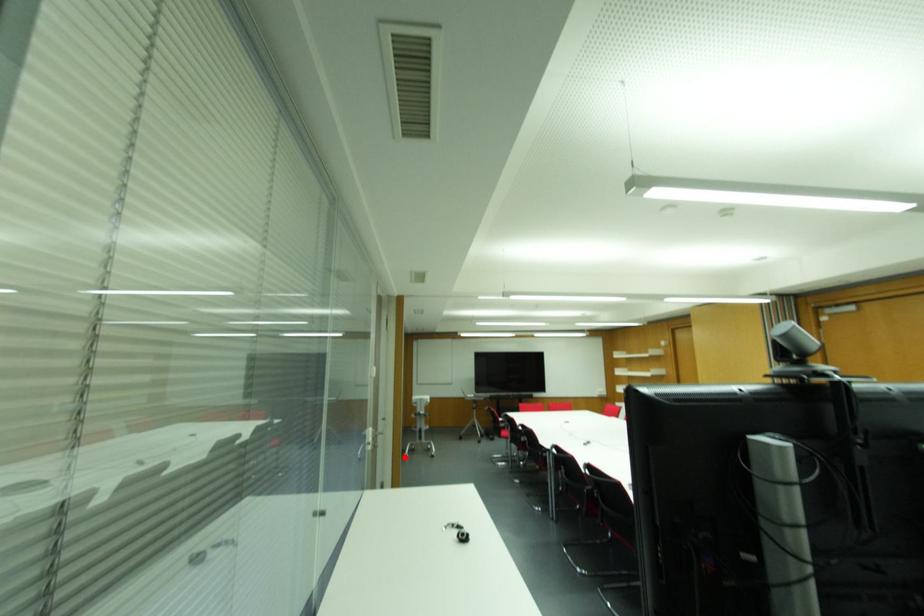
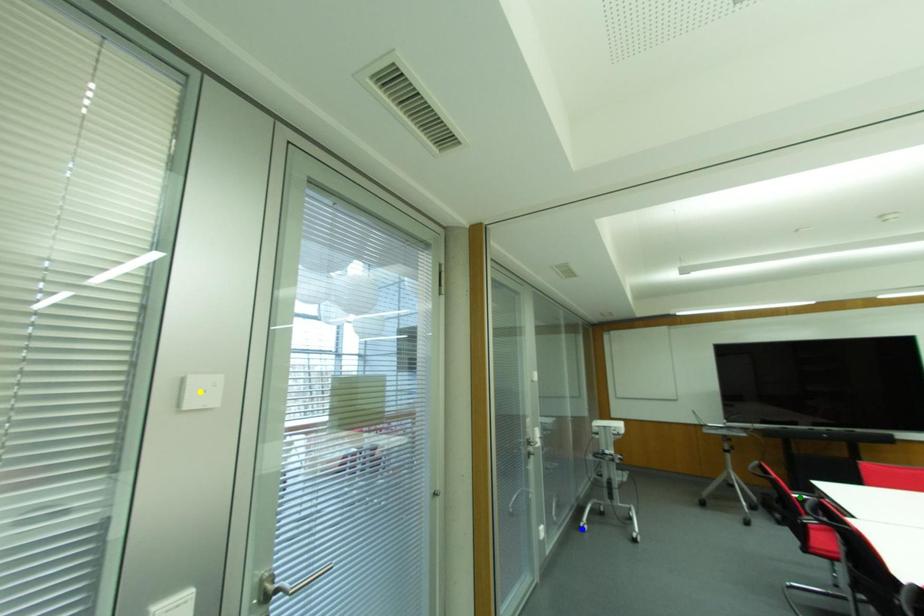
Question: I am providing you with two images of the same scene from different viewpoints. A red point is marked on the first image. You are given multiple points on the second image. Which point in image 2 is actually the same real-world point as the red point in image 1?

Choices:
 (A) green point
 (B) blue point
 (C) yellow point

Answer: (B)